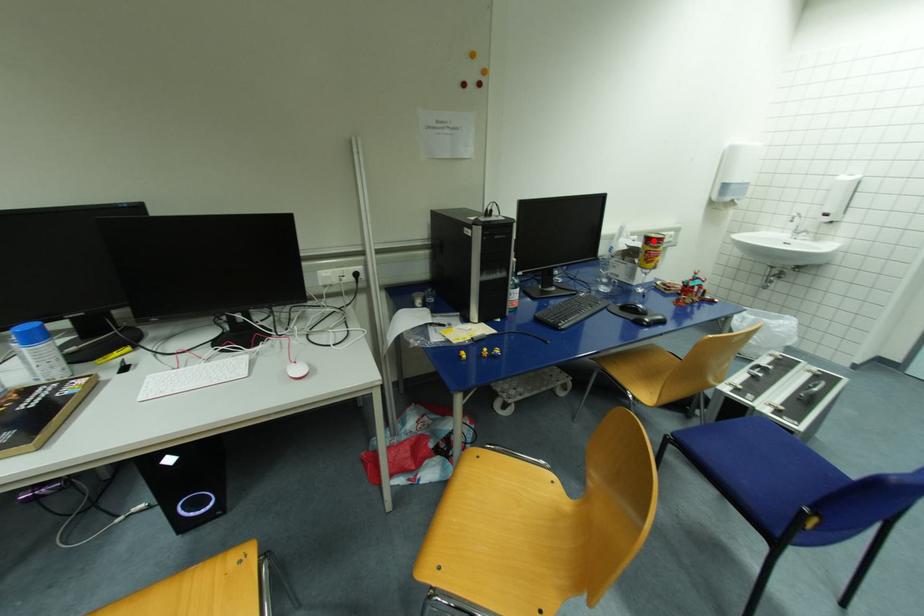
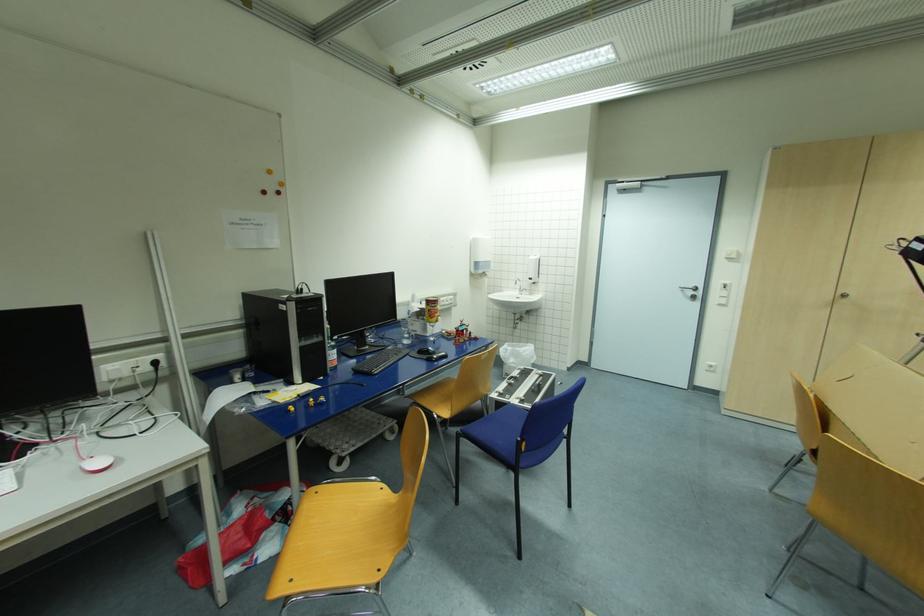
Find the pixel in the second image that matches the highlighted location in the first image.

(433, 302)